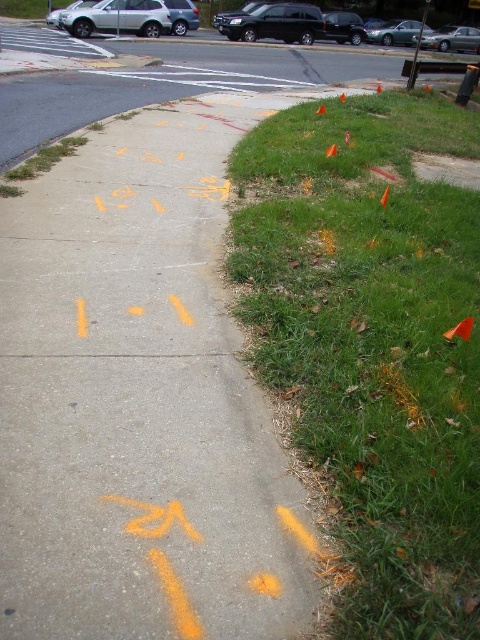
In the scene shown: You are a delivery driver who needs to park your truck 100 feet away from the silver metallic sedan at upper right. Based on the scene, can you park your truck in the construction area near the sidewalk?

The distance between the silver metallic sedan at upper right and the camera is 104.78 feet. Since you need to park 100 feet away, you can park your truck in the construction area near the sidewalk as it is within the required distance.

In the scene shown: You are a construction worker holding a 1.2 meter long measuring tape. You need to measure the distance from your current position to the yellow chalk markings on sidewalk at center. Can you reach the markings with your measuring tape?

The distance of yellow chalk markings on sidewalk at center from camera is 1.21 meters. Since the measuring tape is 1.2 meters long, it is just short by 0.01 meters. Therefore, you cannot reach the yellow chalk markings on sidewalk at center with your current measuring tape.